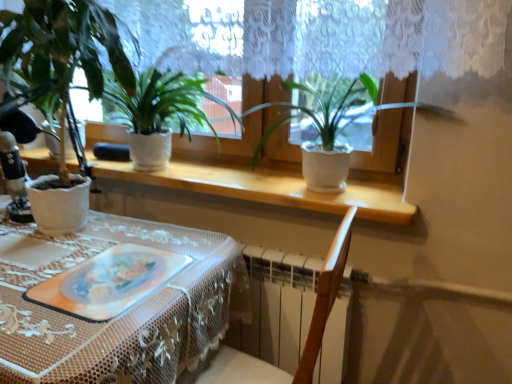
Image resolution: width=512 pixels, height=384 pixels. I want to click on vacant space underneath white matte pot at center, the third houseplant positioned from the left (from a real-world perspective), so click(350, 189).